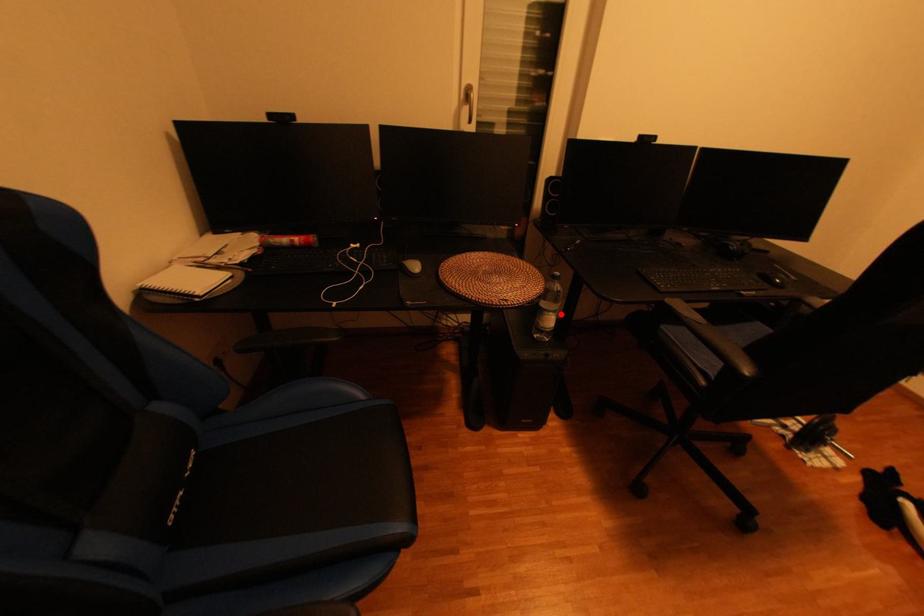
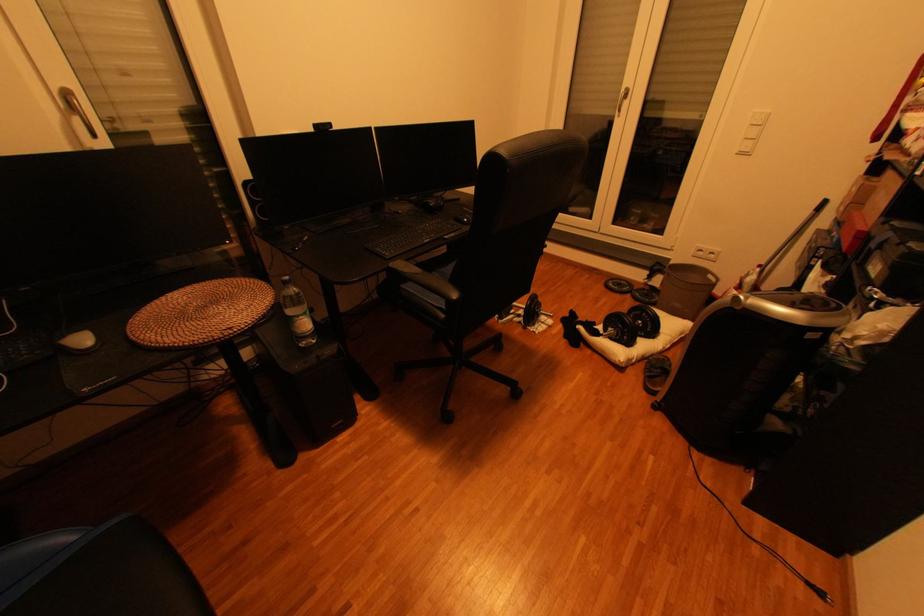
Find the pixel in the second image that matches the highlighted location in the first image.

(310, 318)